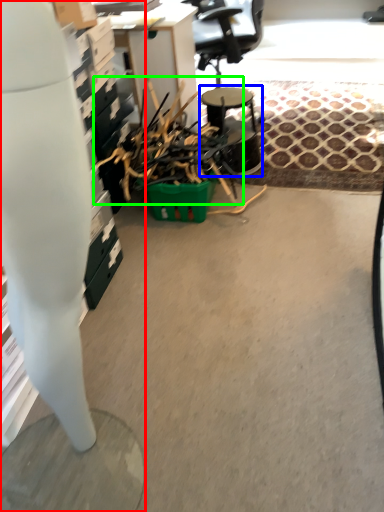
Question: Considering the real-world distances, which object is closest to desk (highlighted by a red box)? round table (highlighted by a blue box) or debris (highlighted by a green box).

Choices:
 (A) round table
 (B) debris

Answer: (B)